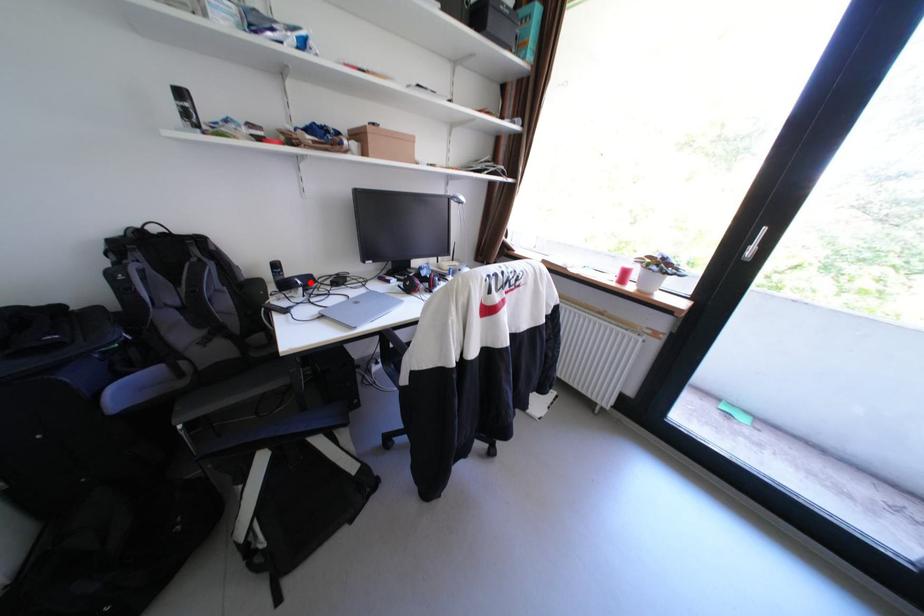
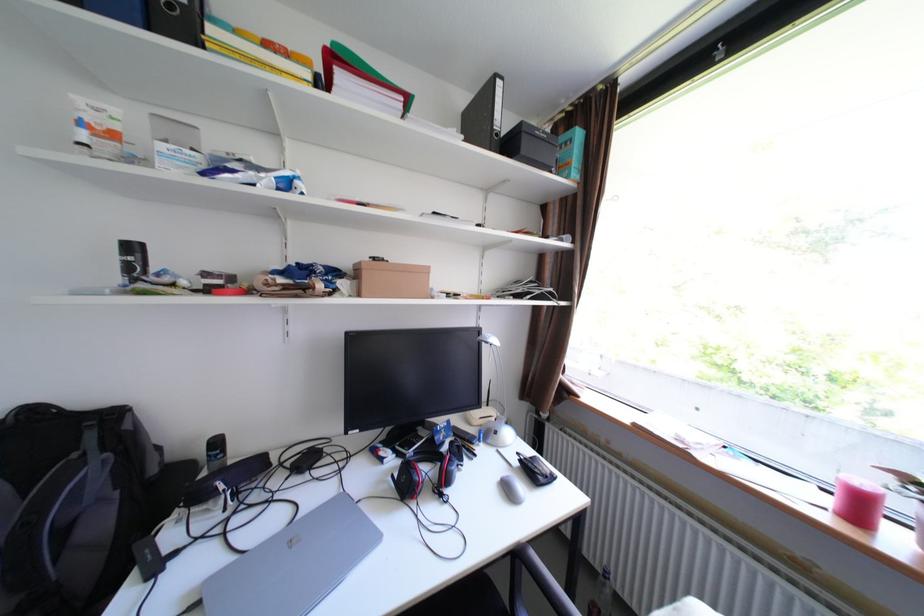
Question: I am providing you with two images of the same scene from different viewpoints. A red point is marked on the first image. Can you still see the location of the red point in image 2?

Choices:
 (A) Yes
 (B) No

Answer: (A)